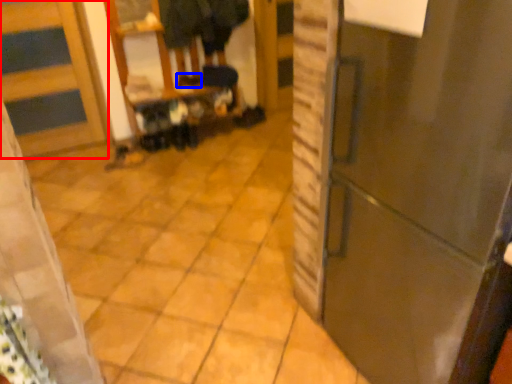
Question: Which object is closer to the camera taking this photo, door (highlighted by a red box) or shoe (highlighted by a blue box)?

Choices:
 (A) door
 (B) shoe

Answer: (A)